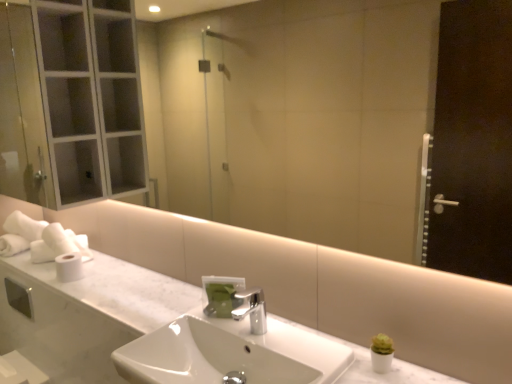
Question: From a real-world perspective, is green matte soap dispenser at center over white glossy sink at center?

Choices:
 (A) no
 (B) yes

Answer: (B)

Question: Is green matte soap dispenser at center located outside white glossy sink at center?

Choices:
 (A) no
 (B) yes

Answer: (B)

Question: Is white glossy sink at center inside green matte soap dispenser at center?

Choices:
 (A) no
 (B) yes

Answer: (A)

Question: From the image's perspective, is green matte soap dispenser at center beneath white glossy sink at center?

Choices:
 (A) yes
 (B) no

Answer: (B)

Question: Is green matte soap dispenser at center closer to camera compared to white glossy sink at center?

Choices:
 (A) no
 (B) yes

Answer: (A)

Question: Can you confirm if green matte soap dispenser at center is thinner than white glossy sink at center?

Choices:
 (A) yes
 (B) no

Answer: (A)

Question: From the image's perspective, is white matte toilet paper at left, marked as the 2th toilet paper in a front-to-back arrangement, under green matte soap dispenser at center?

Choices:
 (A) yes
 (B) no

Answer: (B)

Question: From a real-world perspective, is white matte toilet paper at left, marked as the 2th toilet paper in a front-to-back arrangement, physically below green matte soap dispenser at center?

Choices:
 (A) no
 (B) yes

Answer: (A)

Question: Is white matte toilet paper at left, marked as the 2th toilet paper in a front-to-back arrangement, behind green matte soap dispenser at center?

Choices:
 (A) yes
 (B) no

Answer: (A)

Question: Considering the relative sizes of white matte toilet paper at left, marked as the 2th toilet paper in a front-to-back arrangement, and green matte soap dispenser at center in the image provided, is white matte toilet paper at left, marked as the 2th toilet paper in a front-to-back arrangement, bigger than green matte soap dispenser at center?

Choices:
 (A) yes
 (B) no

Answer: (A)

Question: Is green matte soap dispenser at center at the back of white matte toilet paper at left, marked as the 2th toilet paper in a front-to-back arrangement?

Choices:
 (A) no
 (B) yes

Answer: (A)

Question: Are white matte toilet paper at left, the first toilet paper from the back, and green matte soap dispenser at center beside each other?

Choices:
 (A) yes
 (B) no

Answer: (B)

Question: Could you tell me if polished metallic faucet at center is turned towards white matte toilet paper at left, which ranks as the 1th toilet paper in front-to-back order?

Choices:
 (A) yes
 (B) no

Answer: (B)